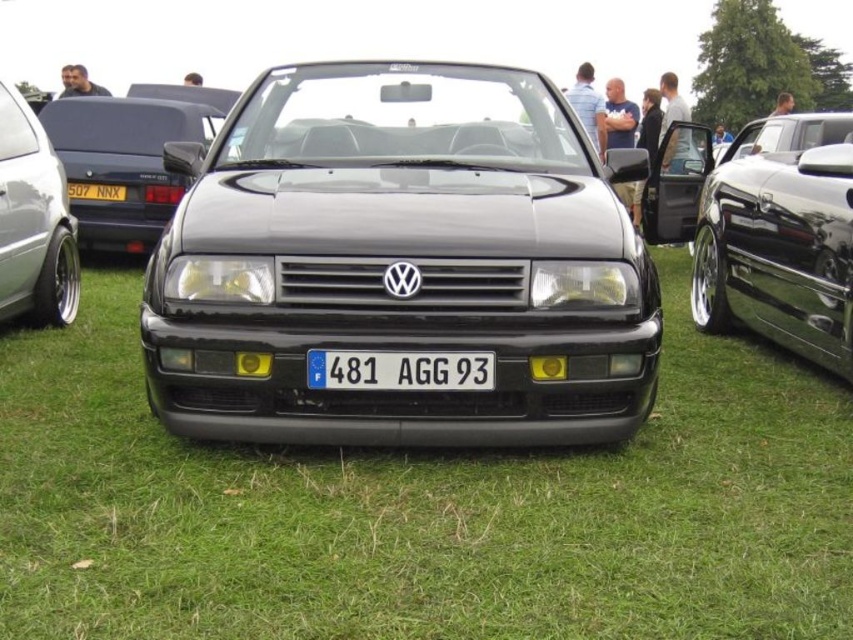
Based on the photo, can you confirm if matte black car at left is positioned to the right of white plastic license plate at center?

In fact, matte black car at left is to the left of white plastic license plate at center.

Measure the distance between matte black car at left and camera.

3.39 meters

The height and width of the screenshot is (640, 853). Identify the location of matte black car at left. (33, 221).

In the scene shown: Is green grass at center to the left of white plastic license plate at center from the viewer's perspective?

Yes, green grass at center is to the left of white plastic license plate at center.

Is point (599, 554) behind point (456, 364)?

No, it is in front of (456, 364).

Is point (48, 579) farther from viewer compared to point (374, 368)?

No, (48, 579) is in front of (374, 368).

Identify the location of green grass at center. (421, 509).

Can you confirm if green grass at center is taller than matte black car at left?

Incorrect, green grass at center's height is not larger of matte black car at left's.

Can you confirm if green grass at center is positioned to the left of matte black car at left?

No, green grass at center is not to the left of matte black car at left.

Is point (717, 618) farther from camera compared to point (48, 314)?

No, it is not.

This screenshot has width=853, height=640. Find the location of `green grass at center`. green grass at center is located at coordinates tap(421, 509).